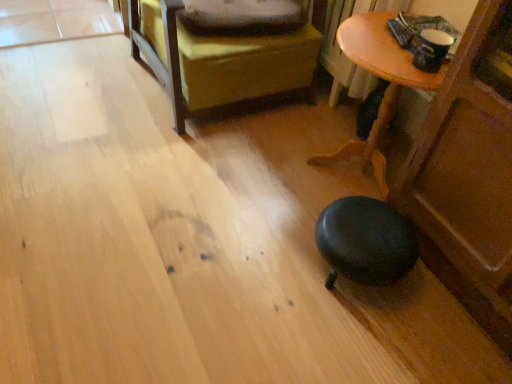
What is the approximate width of soft gray pillow at upper center?

The width of soft gray pillow at upper center is 15.38 inches.

Find the location of a particular element. The height and width of the screenshot is (384, 512). soft gray pillow at upper center is located at coordinates (242, 17).

In the image, there is a wooden table at lower right. Identify the location of furniture above it (from the image's perspective). The width and height of the screenshot is (512, 384). (223, 51).

Between wooden table at lower right and leather ottoman at center, which one has less height?

wooden table at lower right.

Which object is thinner, wooden table at lower right or leather ottoman at center?

wooden table at lower right.

The width and height of the screenshot is (512, 384). What are the coordinates of `pillow located below the leather ottoman at center (from the image's perspective)` in the screenshot? It's located at (242, 17).

Is soft gray pillow at upper center a part of leather ottoman at center?

Yes, leather ottoman at center contains soft gray pillow at upper center.

Looking at this image, considering the relative sizes of leather ottoman at center and soft gray pillow at upper center in the image provided, is leather ottoman at center wider than soft gray pillow at upper center?

Yes, leather ottoman at center is wider than soft gray pillow at upper center.

Considering the relative sizes of leather ottoman at center and soft gray pillow at upper center in the image provided, is leather ottoman at center bigger than soft gray pillow at upper center?

Indeed, leather ottoman at center has a larger size compared to soft gray pillow at upper center.

What are the coordinates of `pillow on the left of wooden table at lower right` in the screenshot? It's located at (242, 17).

Considering the positions of objects soft gray pillow at upper center and wooden table at lower right in the image provided, who is more to the right, soft gray pillow at upper center or wooden table at lower right?

From the viewer's perspective, wooden table at lower right appears more on the right side.

Which of these two, soft gray pillow at upper center or wooden table at lower right, stands shorter?

soft gray pillow at upper center.

From a real-world perspective, who is located higher, soft gray pillow at upper center or wooden table at lower right?

soft gray pillow at upper center.

Considering the sizes of soft gray pillow at upper center and leather ottoman at center in the image, is soft gray pillow at upper center bigger or smaller than leather ottoman at center?

Clearly, soft gray pillow at upper center is smaller in size than leather ottoman at center.

This screenshot has width=512, height=384. Find the location of `pillow that is behind the leather ottoman at center`. pillow that is behind the leather ottoman at center is located at coordinates (242, 17).

Is soft gray pillow at upper center positioned with its back to leather ottoman at center?

Yes.

From their relative heights in the image, would you say leather ottoman at center is taller or shorter than wooden table at lower right?

Considering their sizes, leather ottoman at center has more height than wooden table at lower right.

Can you confirm if leather ottoman at center is thinner than wooden table at lower right?

No.

Which is correct: leather ottoman at center is inside wooden table at lower right, or outside of it?

leather ottoman at center is not enclosed by wooden table at lower right.

From a real-world perspective, between leather ottoman at center and wooden table at lower right, who is vertically higher?

From a 3D spatial view, leather ottoman at center is above.

Visually, is wooden table at lower right positioned to the left or to the right of soft gray pillow at upper center?

From the image, it's evident that wooden table at lower right is to the right of soft gray pillow at upper center.

Can soft gray pillow at upper center be found inside wooden table at lower right?

No, soft gray pillow at upper center is not a part of wooden table at lower right.

Considering the sizes of objects wooden table at lower right and soft gray pillow at upper center in the image provided, who is smaller, wooden table at lower right or soft gray pillow at upper center?

soft gray pillow at upper center.

Which of these two, wooden table at lower right or soft gray pillow at upper center, is wider?

With larger width is wooden table at lower right.

Locate an element on the screen. This screenshot has height=384, width=512. table that is below the leather ottoman at center (from the image's perspective) is located at coordinates (382, 78).

You are a GUI agent. You are given a task and a screenshot of the screen. Output one action in this format:
    pyautogui.click(x=<x>, y=<y>)
    Task: Click on the furniture in front of the soft gray pillow at upper center
    The image size is (512, 384).
    Given the screenshot: What is the action you would take?
    pyautogui.click(x=223, y=51)

From the image, which object appears to be farther from soft gray pillow at upper center, leather ottoman at center or wooden table at lower right?

Among the two, wooden table at lower right is located further to soft gray pillow at upper center.

Estimate the real-world distances between objects in this image. Which object is further from soft gray pillow at upper center, wooden table at lower right or leather ottoman at center?

wooden table at lower right.

From the image, which object appears to be nearer to leather ottoman at center, soft gray pillow at upper center or wooden table at lower right?

soft gray pillow at upper center is closer to leather ottoman at center.

From the picture: Based on their spatial positions, is leather ottoman at center or soft gray pillow at upper center closer to wooden table at lower right?

The object closer to wooden table at lower right is leather ottoman at center.

Which object lies nearer to the anchor point wooden table at lower right, soft gray pillow at upper center or leather ottoman at center?

leather ottoman at center lies closer to wooden table at lower right than the other object.

When comparing their distances from leather ottoman at center, does wooden table at lower right or soft gray pillow at upper center seem closer?

The object closer to leather ottoman at center is soft gray pillow at upper center.

The width and height of the screenshot is (512, 384). I want to click on pillow between leather ottoman at center and wooden table at lower right from left to right, so click(242, 17).